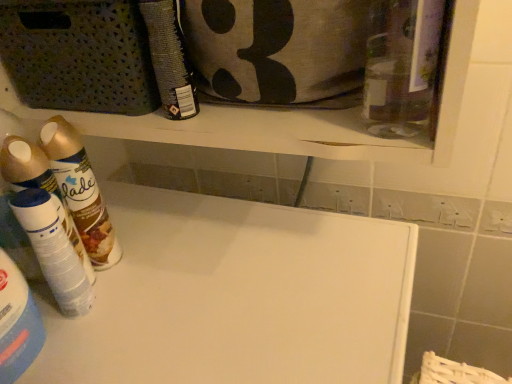
I want to click on free location to the right of white plastic spray can at left, positioned as the second cleaning product in left-to-right order, so click(x=197, y=284).